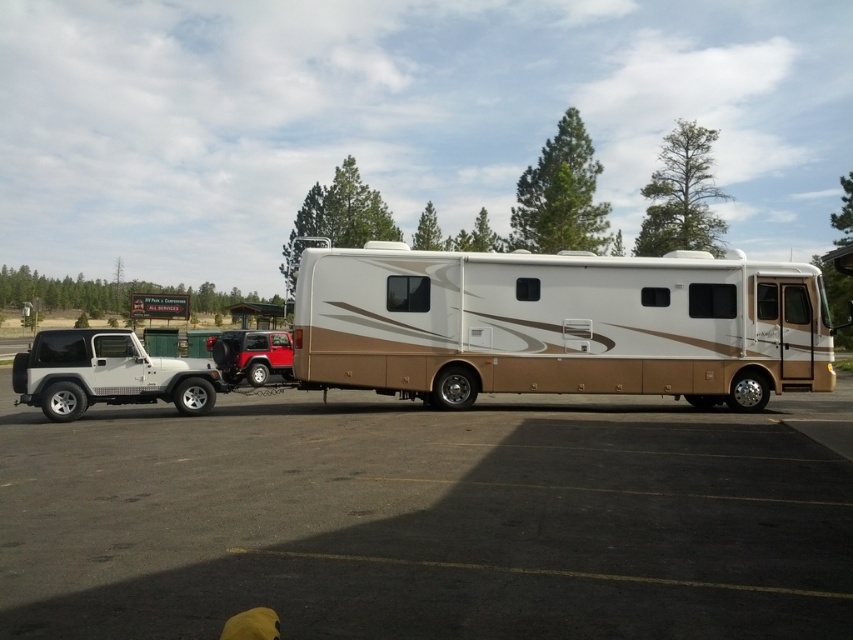
You are a driver trying to navigate through a narrow alley. You see the matte brown rv at center and the metallic red suv at left. Which vehicle should you avoid hitting to stay on the correct path?

The matte brown rv at center is above the metallic red suv at left, so you should avoid hitting the metallic red suv at left to stay on the correct path.

You are a delivery driver who needs to park your truck between the matte brown rv at center and the metallic red suv at left. The truck requires 20 feet of space. Is there enough space between them to park?

The matte brown rv at center is 29.68 feet away from the metallic red suv at left, so yes, there is enough space between them to park the truck since 29.68 feet is greater than the required 20 feet.

You are planning to park both the matte brown rv at center and the metallic red suv at left in a parking lot. Given their sizes, which vehicle will require more space to park?

The matte brown rv at center requires more space to park because it is larger in size than the metallic red suv at left.